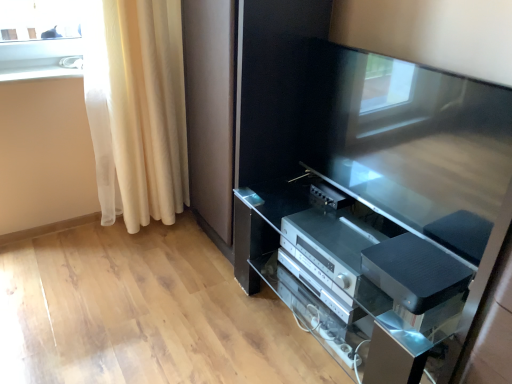
Find the location of `vacant point above silver metallic stereo at lower center, which is counted as the second appliance, starting from the front (from a real-world perspective)`. vacant point above silver metallic stereo at lower center, which is counted as the second appliance, starting from the front (from a real-world perspective) is located at coordinates (328, 236).